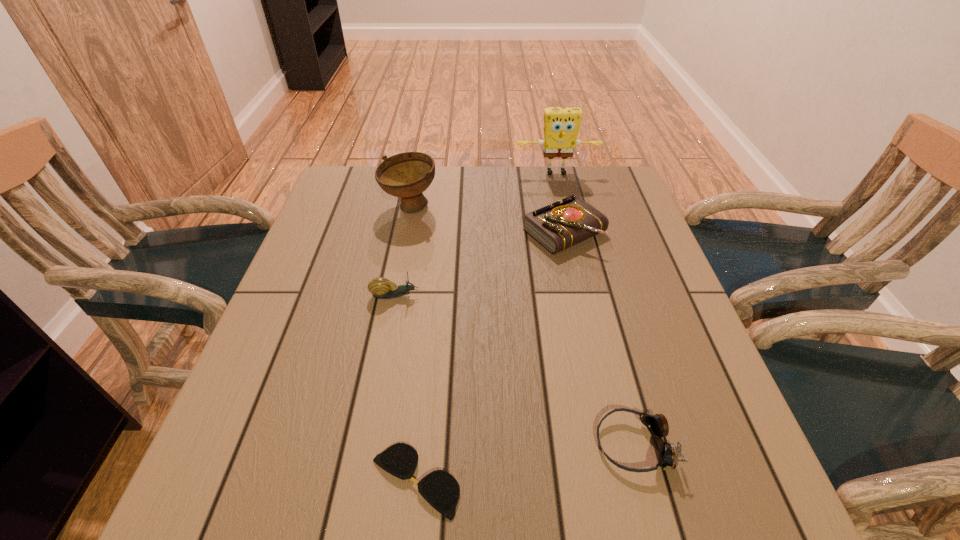
What are the coordinates of `free space located 0.110m on the front-facing side of the fourth farthest object` in the screenshot? It's located at (468, 295).

Locate an element on the screen. blank area located through the lenses of the fifth tallest object is located at coordinates (x=555, y=444).

In order to click on free space located 0.120m through the lenses of the fifth tallest object in this screenshot , I will do `click(525, 444)`.

The width and height of the screenshot is (960, 540). What are the coordinates of `free spot located through the lenses of the fifth tallest object` in the screenshot? It's located at (401, 444).

At what (x,y) coordinates should I click in order to perform the action: click on vacant point located 0.080m on the right of the shortest object. Please return your answer as a coordinate pair (x, y). Looking at the image, I should click on (511, 481).

The height and width of the screenshot is (540, 960). Identify the location of sponge at the far edge. (561, 125).

The height and width of the screenshot is (540, 960). I want to click on soup bowl that is at the far edge, so click(406, 175).

Locate an element on the screen. diary positioned at the far edge is located at coordinates (569, 221).

Where is `goggles present at the near edge`? Image resolution: width=960 pixels, height=540 pixels. goggles present at the near edge is located at coordinates (657, 424).

The height and width of the screenshot is (540, 960). I want to click on spectacles that is at the near edge, so click(x=440, y=489).